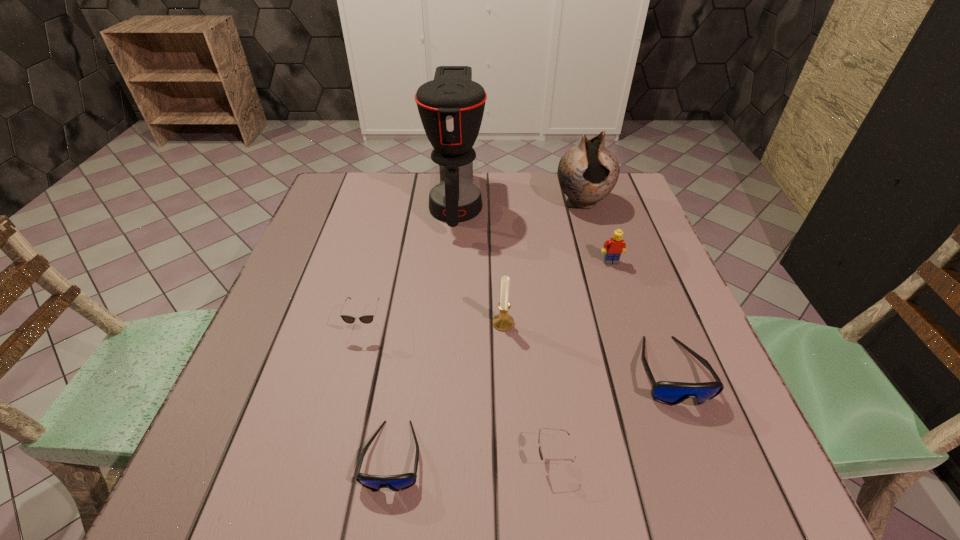
Where is `vacant space located in front of the lenses of the smaller black sunglasses`? vacant space located in front of the lenses of the smaller black sunglasses is located at coordinates (462, 458).

You are a GUI agent. You are given a task and a screenshot of the screen. Output one action in this format:
    pyautogui.click(x=<x>, y=<y>)
    Task: Click on the free space located in front of the lenses of the smaller black sunglasses
    
    Given the screenshot: What is the action you would take?
    click(334, 458)

You are a GUI agent. You are given a task and a screenshot of the screen. Output one action in this format:
    pyautogui.click(x=<x>, y=<y>)
    Task: Click on the vacant position located in front of the lenses of the smaller black sunglasses
    The height and width of the screenshot is (540, 960).
    Given the screenshot: What is the action you would take?
    pyautogui.click(x=420, y=458)

This screenshot has height=540, width=960. Find the location of `coffee maker situated at the far edge`. coffee maker situated at the far edge is located at coordinates (451, 107).

Find the location of a particular element. pottery that is positioned at the far edge is located at coordinates (587, 173).

Locate an element on the screen. The width and height of the screenshot is (960, 540). object located in the left edge section of the desktop is located at coordinates [366, 319].

You are a GUI agent. You are given a task and a screenshot of the screen. Output one action in this format:
    pyautogui.click(x=<x>, y=<y>)
    Task: Click on the pottery positioned at the right edge
    Image resolution: width=960 pixels, height=540 pixels.
    Given the screenshot: What is the action you would take?
    pyautogui.click(x=587, y=173)

Locate an element on the screen. The width and height of the screenshot is (960, 540). Lego that is at the right edge is located at coordinates (615, 246).

Identify the location of sunglasses located in the right edge section of the desktop. (671, 393).

This screenshot has width=960, height=540. In order to click on object that is positioned at the far right corner in this screenshot , I will do `click(587, 173)`.